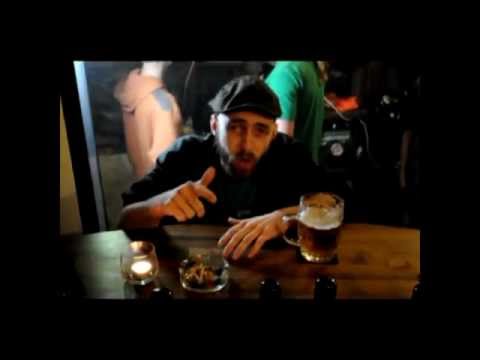
Image resolution: width=480 pixels, height=360 pixels. Identify the location of table. (364, 245).